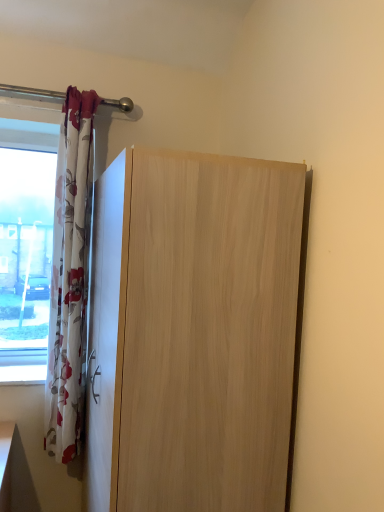
In order to face light wood cupboard at center, should I rotate leftwards or rightwards?

You should rotate left by 3.766 degrees.

This screenshot has height=512, width=384. What do you see at coordinates (192, 332) in the screenshot? I see `light wood cupboard at center` at bounding box center [192, 332].

The height and width of the screenshot is (512, 384). Identify the location of light wood cupboard at center. (192, 332).

In order to click on floral fabric curtain at left in this screenshot , I will do `click(70, 275)`.

What do you see at coordinates (70, 275) in the screenshot? I see `floral fabric curtain at left` at bounding box center [70, 275].

Locate an element on the screen. The image size is (384, 512). light wood cupboard at center is located at coordinates (192, 332).

From the picture: Would you say floral fabric curtain at left is to the left or to the right of light wood cupboard at center in the picture?

floral fabric curtain at left is to the left of light wood cupboard at center.

Is floral fabric curtain at left closer to camera compared to light wood cupboard at center?

No, floral fabric curtain at left is behind light wood cupboard at center.

Does point (80, 394) come farther from viewer compared to point (95, 371)?

Yes, it is behind point (95, 371).

From the image's perspective, which is below, floral fabric curtain at left or light wood cupboard at center?

light wood cupboard at center.

In the scene shown: From a real-world perspective, is floral fabric curtain at left positioned over light wood cupboard at center based on gravity?

Yes.

Which of these two, floral fabric curtain at left or light wood cupboard at center, is wider?

light wood cupboard at center is wider.

From the picture: Which of these two, floral fabric curtain at left or light wood cupboard at center, stands taller?

floral fabric curtain at left.

Considering the sizes of objects floral fabric curtain at left and light wood cupboard at center in the image provided, who is smaller, floral fabric curtain at left or light wood cupboard at center?

Smaller between the two is floral fabric curtain at left.

Based on the photo, is floral fabric curtain at left not within light wood cupboard at center?

Yes, floral fabric curtain at left is located beyond the bounds of light wood cupboard at center.

Is the surface of floral fabric curtain at left in direct contact with light wood cupboard at center?

No, floral fabric curtain at left is not in contact with light wood cupboard at center.

Could you tell me if floral fabric curtain at left is facing light wood cupboard at center?

No, floral fabric curtain at left is not aimed at light wood cupboard at center.

What's the angular difference between floral fabric curtain at left and light wood cupboard at center's facing directions?

floral fabric curtain at left and light wood cupboard at center are facing 90 degrees away from each other.

Find the location of a particular element. The width and height of the screenshot is (384, 512). cupboard located underneath the floral fabric curtain at left (from a real-world perspective) is located at coordinates (192, 332).

Does light wood cupboard at center appear on the left side of floral fabric curtain at left?

Incorrect, light wood cupboard at center is not on the left side of floral fabric curtain at left.

Is light wood cupboard at center positioned in front of floral fabric curtain at left?

Yes, it is.

Does point (202, 413) come farther from viewer compared to point (56, 355)?

No, (202, 413) is in front of (56, 355).

From the image's perspective, relative to floral fabric curtain at left, is light wood cupboard at center above or below?

From the image's perspective, light wood cupboard at center appears below floral fabric curtain at left.

From a real-world perspective, who is located higher, light wood cupboard at center or floral fabric curtain at left?

floral fabric curtain at left, from a real-world perspective.

Looking at their sizes, would you say light wood cupboard at center is wider or thinner than floral fabric curtain at left?

In the image, light wood cupboard at center appears to be wider than floral fabric curtain at left.

Considering the sizes of objects light wood cupboard at center and floral fabric curtain at left in the image provided, who is shorter, light wood cupboard at center or floral fabric curtain at left?

light wood cupboard at center.

Considering the sizes of objects light wood cupboard at center and floral fabric curtain at left in the image provided, who is bigger, light wood cupboard at center or floral fabric curtain at left?

With larger size is light wood cupboard at center.

Would you say light wood cupboard at center contains floral fabric curtain at left?

No, floral fabric curtain at left is not surrounded by light wood cupboard at center.

Would you consider light wood cupboard at center to be distant from floral fabric curtain at left?

No.

Looking at this image, is light wood cupboard at center aimed at floral fabric curtain at left?

Yes, light wood cupboard at center faces towards floral fabric curtain at left.

You are a GUI agent. You are given a task and a screenshot of the screen. Output one action in this format:
    pyautogui.click(x=<x>, y=<y>)
    Task: Click on the cupboard below the floral fabric curtain at left (from the image's perspective)
    The image size is (384, 512).
    Given the screenshot: What is the action you would take?
    pyautogui.click(x=192, y=332)

This screenshot has width=384, height=512. I want to click on cupboard below the floral fabric curtain at left (from the image's perspective), so click(x=192, y=332).

At what (x,y) coordinates should I click in order to perform the action: click on curtain lying behind the light wood cupboard at center. Please return your answer as a coordinate pair (x, y). The image size is (384, 512). Looking at the image, I should click on [x=70, y=275].